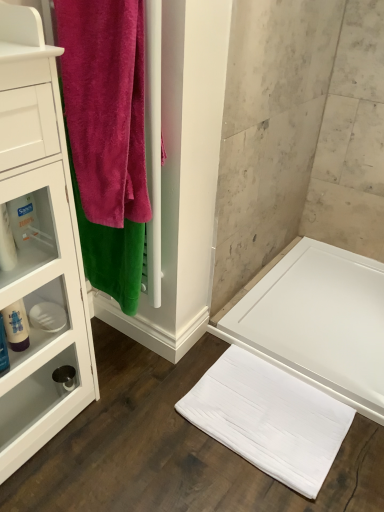
Question: Is point (0, 351) positioned closer to the camera than point (54, 377)?

Choices:
 (A) closer
 (B) farther

Answer: (A)

Question: In terms of width, does translucent plastic bottle at left, the 2th toiletry from the back, look wider or thinner when compared to matte black faucet at lower left, the 1th toiletry ordered from the bottom?

Choices:
 (A) wide
 (B) thin

Answer: (B)

Question: Based on their relative distances, which object is farther from the white soft towel at lower center?

Choices:
 (A) matte black faucet at lower left, which ranks as the first toiletry in back-to-front order
 (B) translucent plastic bottle at left, the 2th toiletry positioned from the top
 (C) velvety pink towel at left
 (D) white glossy cabinet at left
 (E) white plastic container at left, placed as the third toiletry when sorted from bottom to top

Answer: (E)

Question: Which is nearer to the velvety pink towel at left?

Choices:
 (A) translucent plastic bottle at left
 (B) matte black faucet at lower left, the 3th toiletry from the top
 (C) white soft towel at lower center
 (D) white glossy cabinet at left
 (E) white glossy bath at lower right

Answer: (D)